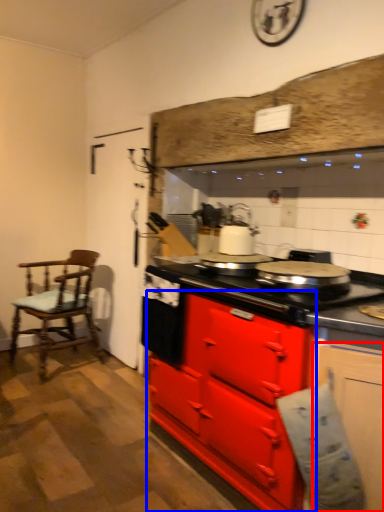
Question: Among these objects, which one is nearest to the camera, cabinetry (highlighted by a red box) or cabinetry (highlighted by a blue box)?

Choices:
 (A) cabinetry
 (B) cabinetry

Answer: (A)